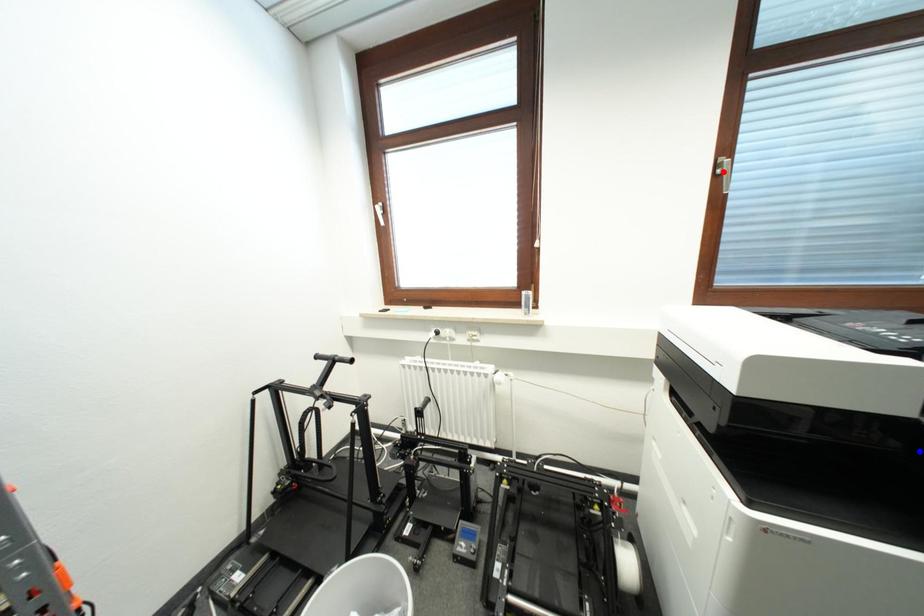
Question: In the image, two points are highlighted. Which point is nearer to the camera? Reply with the corresponding letter.

Choices:
 (A) blue point
 (B) red point

Answer: (A)